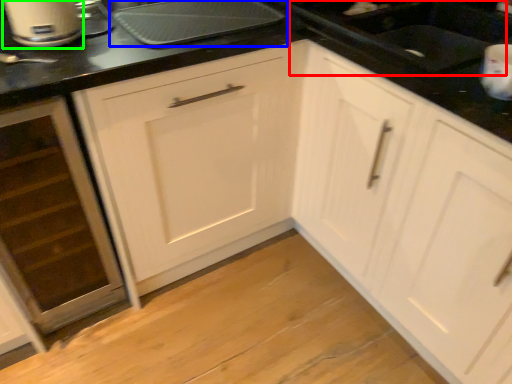
Question: Which is farther away from sink (highlighted by a red box)? kitchen appliance (highlighted by a blue box) or home appliance (highlighted by a green box)?

Choices:
 (A) kitchen appliance
 (B) home appliance

Answer: (B)